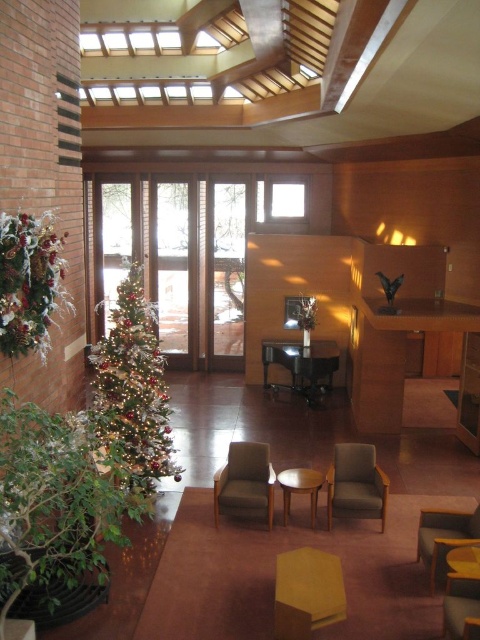
Question: Is dark brown leather armchair at center to the left of wooden table at center from the viewer's perspective?

Choices:
 (A) yes
 (B) no

Answer: (A)

Question: Considering the relative positions of light brown wooden table at center and wooden table at lower right in the image provided, where is light brown wooden table at center located with respect to wooden table at lower right?

Choices:
 (A) above
 (B) below

Answer: (B)

Question: Which point is closer to the camera?

Choices:
 (A) dark brown leather armchair at center
 (B) matte yellow armchair at lower right
 (C) wooden armchair at lower right
 (D) wooden table at center

Answer: (C)

Question: Which point is closer to the camera?

Choices:
 (A) (475, 632)
 (B) (453, 531)
 (C) (297, 358)
 (D) (238, 481)

Answer: (A)

Question: Is iridescent metallic christmas tree at left above wooden table at lower right?

Choices:
 (A) yes
 (B) no

Answer: (A)

Question: Which point is farther from the camera taking this photo?

Choices:
 (A) (135, 336)
 (B) (456, 624)
 (C) (273, 499)
 (D) (425, 563)

Answer: (C)